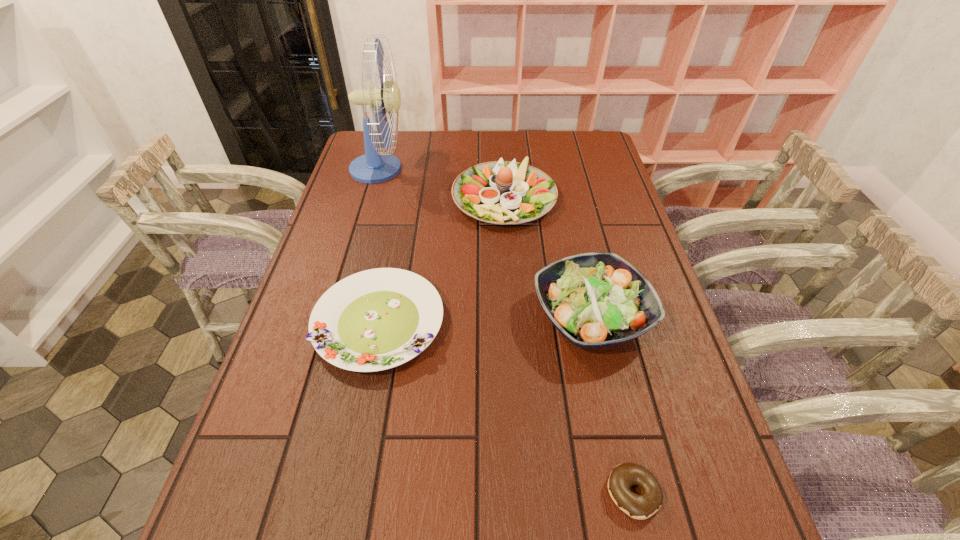
Locate an element on the screen. The height and width of the screenshot is (540, 960). fan that is at the left edge is located at coordinates (374, 166).

I want to click on salad plate present at the left edge, so click(377, 319).

The height and width of the screenshot is (540, 960). I want to click on salad plate that is at the right edge, so click(595, 300).

Find the location of a particular element. doughnut that is at the right edge is located at coordinates (623, 476).

You are a GUI agent. You are given a task and a screenshot of the screen. Output one action in this format:
    pyautogui.click(x=<x>, y=<y>)
    Task: Click on the object that is positioned at the far left corner
    This screenshot has width=960, height=540.
    Given the screenshot: What is the action you would take?
    pyautogui.click(x=374, y=166)

In order to click on free point at the far edge in this screenshot , I will do `click(416, 133)`.

Where is `vacant space at the left edge`? This screenshot has height=540, width=960. vacant space at the left edge is located at coordinates (309, 389).

Find the location of `free space at the right edge`. free space at the right edge is located at coordinates (589, 196).

Where is `free space between the farthest salad plate and the doughnut`? The height and width of the screenshot is (540, 960). free space between the farthest salad plate and the doughnut is located at coordinates (568, 345).

The width and height of the screenshot is (960, 540). Identify the location of vacant area between the farthest salad plate and the shortest object. (568, 345).